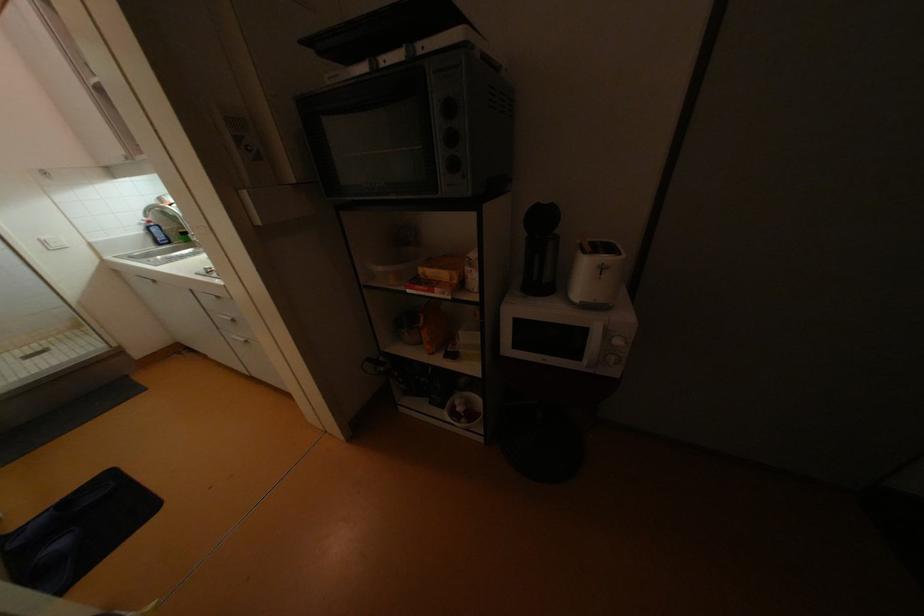
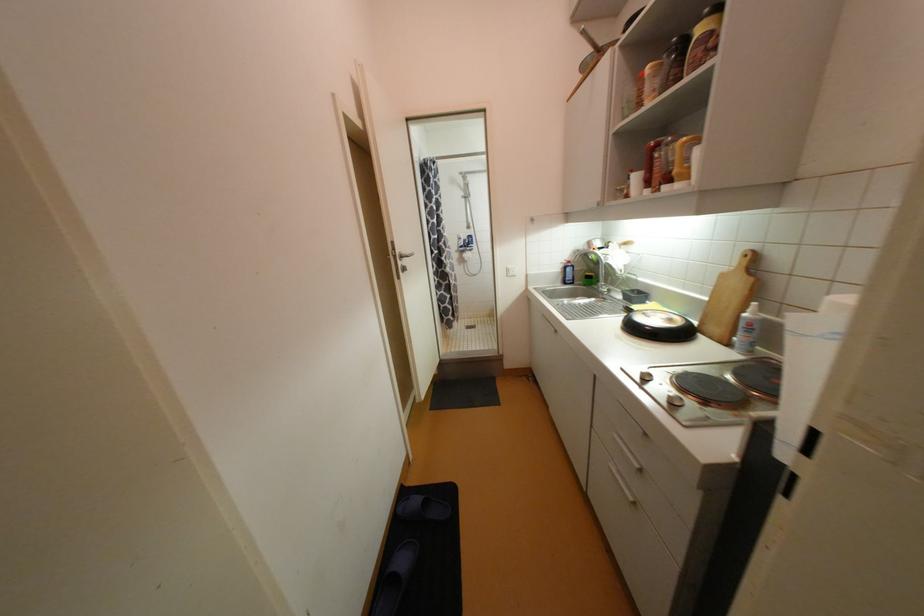
In the second image, find the point that corresponds to pixel 164 245 in the first image.

(569, 283)